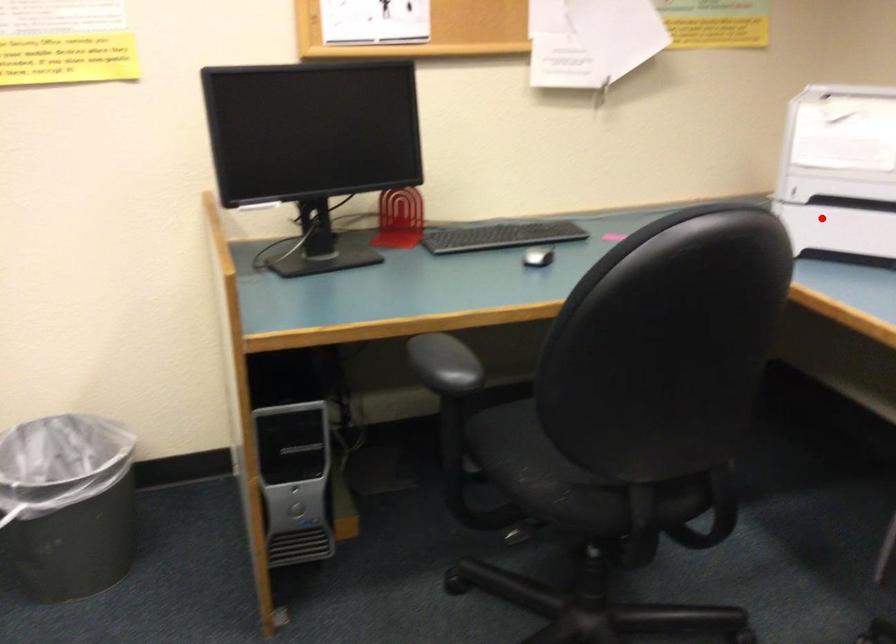
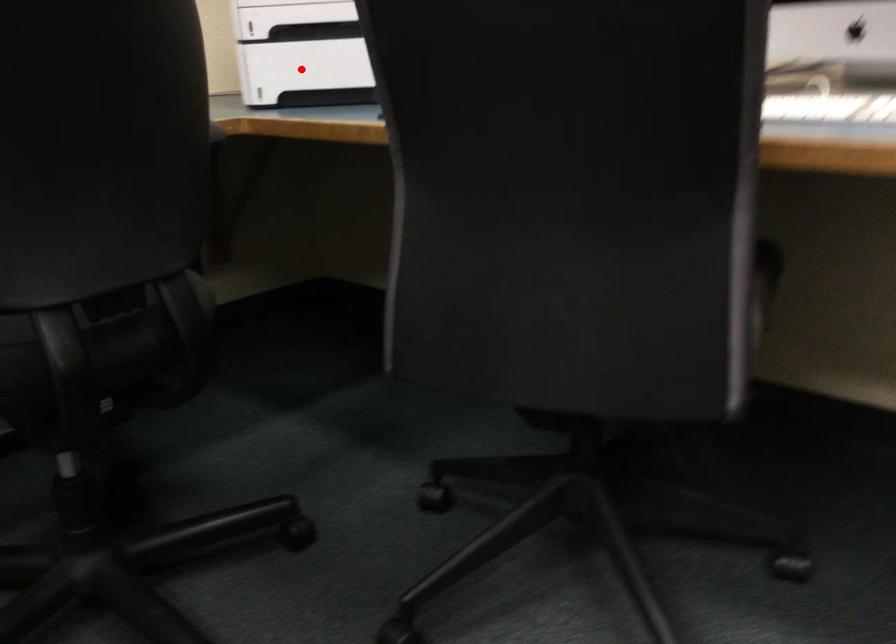
I am providing you with two images of the same scene from different viewpoints. A red point is marked on the first image and another point is marked on the second image. Do the highlighted points in image1 and image2 indicate the same real-world spot?

Yes